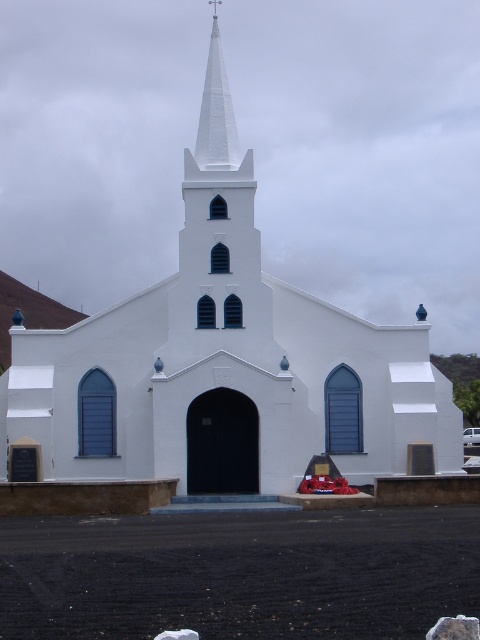
Question: Can you confirm if smooth gray rock at lower right is positioned above white matte van at center?

Choices:
 (A) no
 (B) yes

Answer: (B)

Question: Which point appears closest to the camera in this image?

Choices:
 (A) (465, 429)
 (B) (434, 636)

Answer: (B)

Question: Is smooth gray rock at lower right below white matte van at center?

Choices:
 (A) yes
 (B) no

Answer: (B)

Question: Is white smooth steeple at upper center positioned behind smooth gray rock at lower right?

Choices:
 (A) yes
 (B) no

Answer: (A)

Question: Which point is farther to the camera?

Choices:
 (A) (444, 620)
 (B) (204, 106)
 (C) (471, 429)

Answer: (C)

Question: Which point is farther from the camera taking this photo?

Choices:
 (A) (444, 636)
 (B) (472, 444)

Answer: (B)